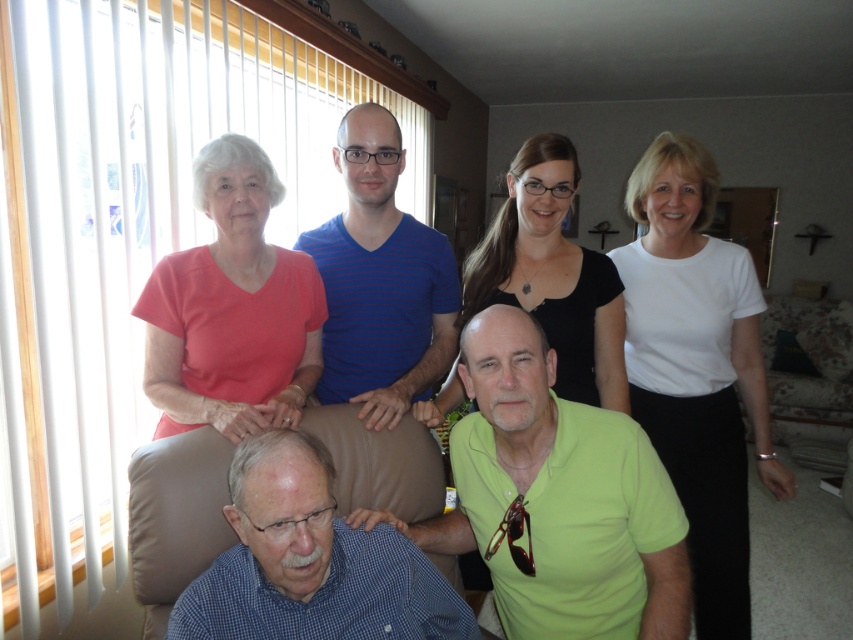
Question: Can you confirm if white smooth shirt at upper right is wider than blue checkered shirt at lower left?

Choices:
 (A) no
 (B) yes

Answer: (B)

Question: Does white smooth shirt at upper right appear over blue checkered shirt at lower left?

Choices:
 (A) yes
 (B) no

Answer: (A)

Question: Among these points, which one is nearest to the camera?

Choices:
 (A) (569, 198)
 (B) (422, 308)
 (C) (664, 440)
 (D) (585, 616)

Answer: (D)

Question: Which object is closer to the camera taking this photo?

Choices:
 (A) matte green shirt at center
 (B) blue checkered shirt at lower left

Answer: (B)

Question: Can you confirm if green matte shirt at center is wider than matte green shirt at center?

Choices:
 (A) no
 (B) yes

Answer: (B)

Question: Which point is closer to the camera?

Choices:
 (A) black matte shirt at upper center
 (B) blue striped shirt at center

Answer: (B)